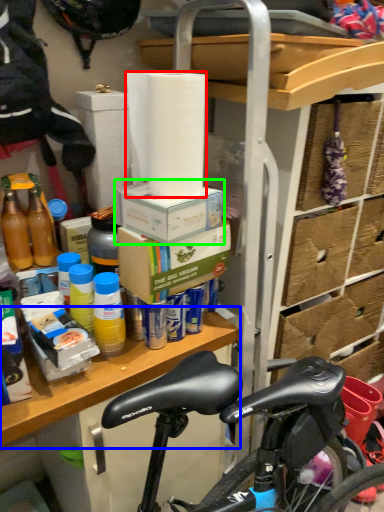
Question: Based on their relative distances, which object is farther from paper towel (highlighted by a red box)? Choose from table (highlighted by a blue box) and box (highlighted by a green box).

Choices:
 (A) table
 (B) box

Answer: (A)